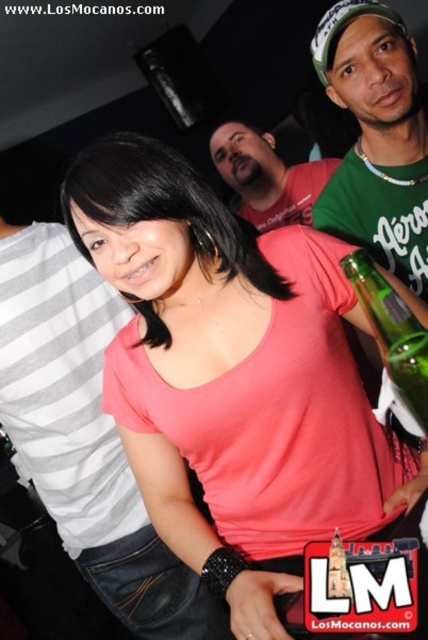
Question: Which of the following is the farthest from the observer?

Choices:
 (A) green matte shirt at upper right
 (B) green glass bottle at right
 (C) pink matte shirt at center

Answer: (A)

Question: Which point appears farthest from the camera in this image?

Choices:
 (A) (363, 8)
 (B) (151, 301)
 (C) (306, 214)
 (D) (392, 308)

Answer: (C)

Question: Does green matte shirt at upper right have a greater width compared to green glass bottle at right?

Choices:
 (A) yes
 (B) no

Answer: (A)

Question: Where is pink matte shirt at center located in relation to green matte shirt at upper right in the image?

Choices:
 (A) below
 (B) above

Answer: (A)

Question: Which of the following is the farthest from the observer?

Choices:
 (A) green glass bottle at right
 (B) pink matte shirt at center

Answer: (A)

Question: Can you confirm if pink matte shirt at center is smaller than green matte shirt at upper right?

Choices:
 (A) yes
 (B) no

Answer: (B)